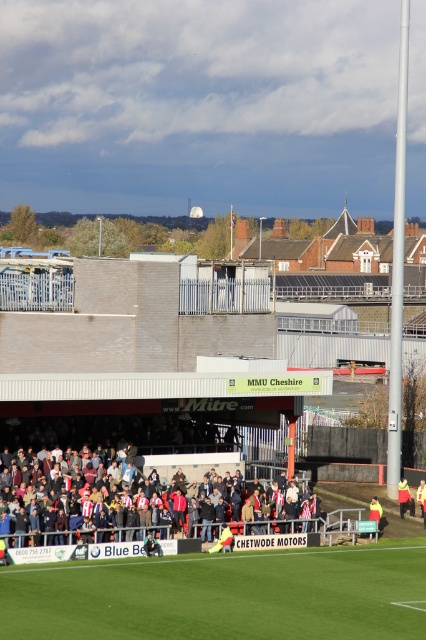
Question: Considering the real-world distances, which object is closest to the yellow fabric jacket at lower center?

Choices:
 (A) red fabric crowd at center
 (B) yellow fabric jacket at lower right

Answer: (B)

Question: Estimate the real-world distances between objects in this image. Which object is closer to the yellow fabric jacket at lower center?

Choices:
 (A) red fabric crowd at center
 (B) yellow fabric jacket at lower right
 (C) green grass at lower center

Answer: (B)

Question: Does yellow fabric jacket at lower right have a smaller size compared to yellow fabric jacket at lower center?

Choices:
 (A) no
 (B) yes

Answer: (B)

Question: Which point is farther from the camera taking this photo?

Choices:
 (A) (218, 564)
 (B) (227, 524)
 (C) (379, 508)
 (D) (78, 483)

Answer: (C)

Question: Can you confirm if red fabric crowd at center is wider than yellow fabric jacket at lower right?

Choices:
 (A) no
 (B) yes

Answer: (B)

Question: Is red fabric crowd at center smaller than yellow fabric jacket at center?

Choices:
 (A) yes
 (B) no

Answer: (B)